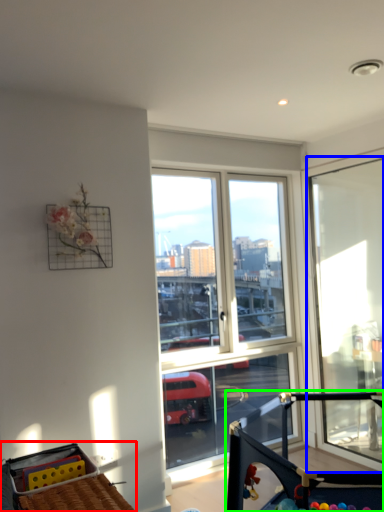
Question: Based on their relative distances, which object is nearer to baby carriage (highlighted by a red box)? Choose from window (highlighted by a blue box) and baby carriage (highlighted by a green box).

Choices:
 (A) window
 (B) baby carriage

Answer: (B)